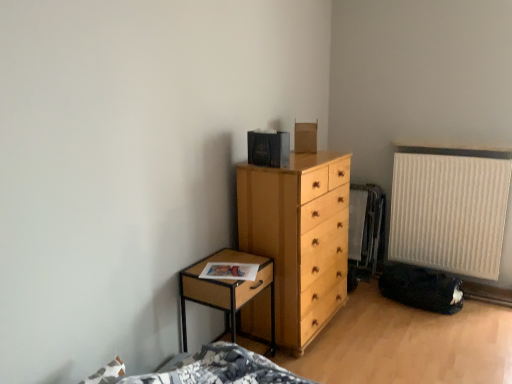
Question: Can beige ribbed radiator at right be found inside light wood chest of drawers at center?

Choices:
 (A) yes
 (B) no

Answer: (B)

Question: Considering the relative sizes of light wood chest of drawers at center and beige ribbed radiator at right in the image provided, is light wood chest of drawers at center wider than beige ribbed radiator at right?

Choices:
 (A) yes
 (B) no

Answer: (A)

Question: Is light wood chest of drawers at center behind beige ribbed radiator at right?

Choices:
 (A) no
 (B) yes

Answer: (A)

Question: Does light wood chest of drawers at center come in front of beige ribbed radiator at right?

Choices:
 (A) no
 (B) yes

Answer: (B)

Question: Does light wood chest of drawers at center have a lesser width compared to beige ribbed radiator at right?

Choices:
 (A) yes
 (B) no

Answer: (B)

Question: From their relative heights in the image, would you say light wood chest of drawers at center is taller or shorter than beige ribbed radiator at right?

Choices:
 (A) short
 (B) tall

Answer: (B)

Question: Is light wood chest of drawers at center in front of or behind beige ribbed radiator at right in the image?

Choices:
 (A) behind
 (B) front

Answer: (B)

Question: From the image's perspective, relative to beige ribbed radiator at right, is light wood chest of drawers at center above or below?

Choices:
 (A) below
 (B) above

Answer: (A)

Question: Based on their positions, is light wood chest of drawers at center located to the left or right of beige ribbed radiator at right?

Choices:
 (A) right
 (B) left

Answer: (B)

Question: From a real-world perspective, is woodennightstand at left positioned above or below light wood chest of drawers at center?

Choices:
 (A) above
 (B) below

Answer: (B)

Question: Considering the positions of woodennightstand at left and light wood chest of drawers at center in the image, is woodennightstand at left wider or thinner than light wood chest of drawers at center?

Choices:
 (A) wide
 (B) thin

Answer: (B)

Question: Is woodennightstand at left inside the boundaries of light wood chest of drawers at center, or outside?

Choices:
 (A) outside
 (B) inside

Answer: (A)

Question: Does point (182, 306) appear closer or farther from the camera than point (270, 253)?

Choices:
 (A) farther
 (B) closer

Answer: (B)

Question: Considering the relative positions of beige ribbed radiator at right and light wood chest of drawers at center in the image provided, is beige ribbed radiator at right to the left or to the right of light wood chest of drawers at center?

Choices:
 (A) left
 (B) right

Answer: (B)

Question: From a real-world perspective, is beige ribbed radiator at right physically located above or below light wood chest of drawers at center?

Choices:
 (A) below
 (B) above

Answer: (B)